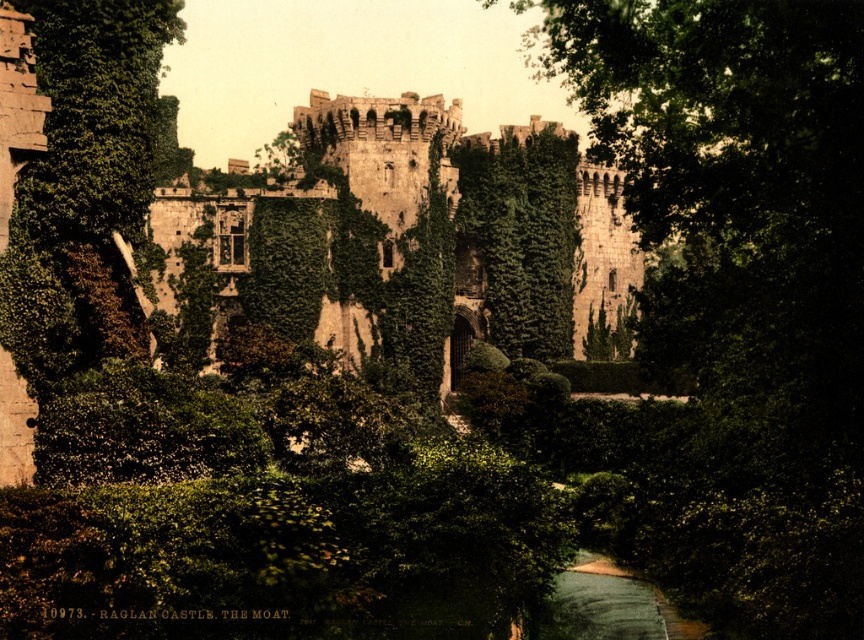
Question: Which point appears closest to the camera in this image?

Choices:
 (A) tap(418, 131)
 (B) tap(707, 573)

Answer: (B)

Question: Does green leafy tree at center lie in front of stone castle at center?

Choices:
 (A) yes
 (B) no

Answer: (A)

Question: Which object is farther from the camera taking this photo?

Choices:
 (A) green leafy tree at center
 (B) stone castle at center

Answer: (B)

Question: Does green leafy tree at center have a larger size compared to stone castle at center?

Choices:
 (A) yes
 (B) no

Answer: (A)

Question: Is green leafy tree at center thinner than stone castle at center?

Choices:
 (A) yes
 (B) no

Answer: (A)